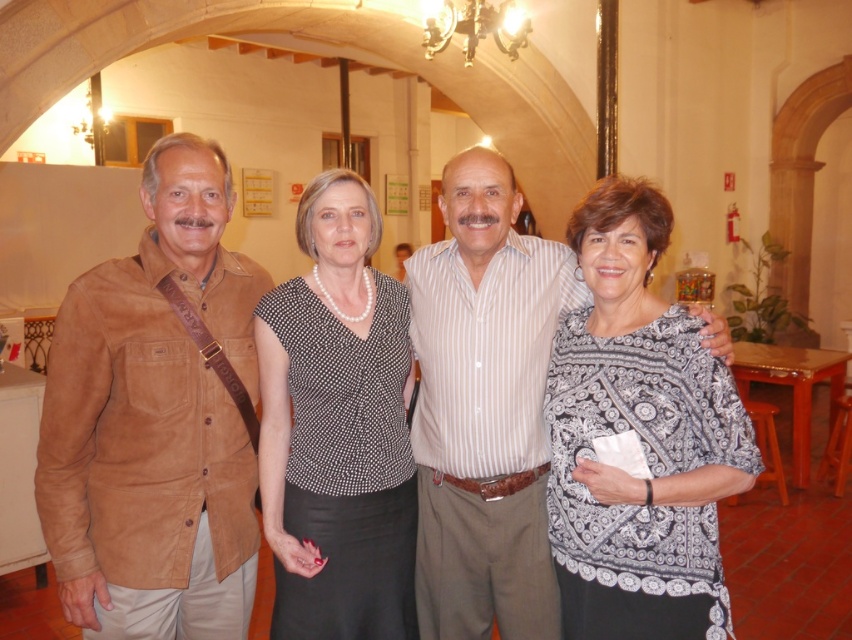
Question: Is suede brown jacket at left positioned in front of black dotted blouse at center?

Choices:
 (A) no
 (B) yes

Answer: (B)

Question: Which of these objects is positioned farthest from the patterned fabric blouse at right?

Choices:
 (A) black dotted blouse at center
 (B) suede brown jacket at left

Answer: (B)

Question: Can you confirm if suede brown jacket at left is positioned below black dotted blouse at center?

Choices:
 (A) yes
 (B) no

Answer: (B)

Question: Which point is farther to the camera?

Choices:
 (A) black dotted blouse at center
 (B) suede brown jacket at left
 (C) patterned fabric blouse at right

Answer: (A)

Question: Which of the following is the closest to the observer?

Choices:
 (A) black dotted blouse at center
 (B) suede brown jacket at left

Answer: (B)

Question: In this image, where is patterned fabric blouse at right located relative to black dotted blouse at center?

Choices:
 (A) right
 (B) left

Answer: (A)